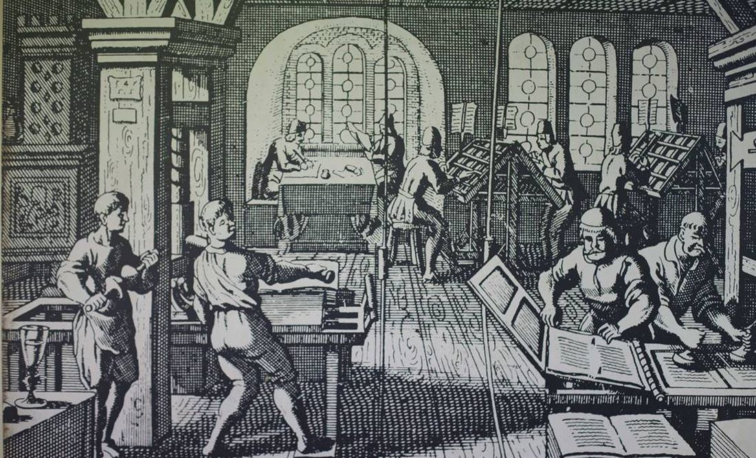
This screenshot has width=756, height=458. What are the coordinates of `cup` in the screenshot? It's located at (35, 356).